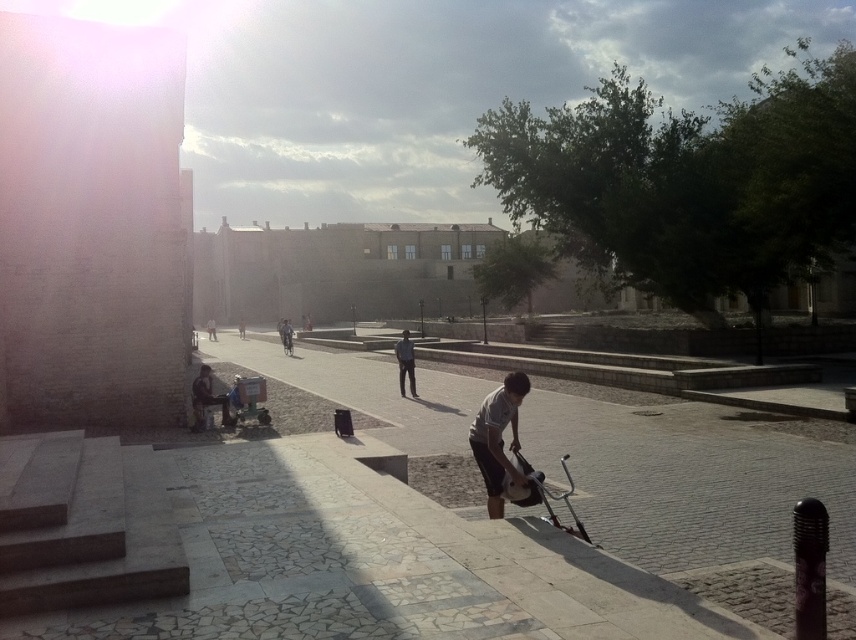
Does point (735, 460) come in front of point (413, 358)?

Yes, point (735, 460) is in front of point (413, 358).

Does gray stone pavement at center have a greater width compared to dark gray jeans at center?

Correct, the width of gray stone pavement at center exceeds that of dark gray jeans at center.

This screenshot has width=856, height=640. What do you see at coordinates (690, 481) in the screenshot?
I see `gray stone pavement at center` at bounding box center [690, 481].

Locate an element on the screen. This screenshot has width=856, height=640. gray stone pavement at center is located at coordinates (690, 481).

Is point (620, 490) less distant than point (519, 448)?

That is False.

At what (x,y) coordinates should I click in order to perform the action: click on gray stone pavement at center. Please return your answer as a coordinate pair (x, y). Looking at the image, I should click on (690, 481).

This screenshot has height=640, width=856. What do you see at coordinates (690, 481) in the screenshot? I see `gray stone pavement at center` at bounding box center [690, 481].

At what (x,y) coordinates should I click in order to perform the action: click on gray stone pavement at center. Please return your answer as a coordinate pair (x, y). Looking at the image, I should click on (690, 481).

Consider the image. Between gray matte skateboard at center and metallic silver baby carriage at lower right, which one is positioned higher?

gray matte skateboard at center is higher up.

Is gray matte skateboard at center positioned behind metallic silver baby carriage at lower right?

Yes, gray matte skateboard at center is further from the viewer.

At what (x,y) coordinates should I click in order to perform the action: click on gray matte skateboard at center. Please return your answer as a coordinate pair (x, y). The width and height of the screenshot is (856, 640). Looking at the image, I should click on (498, 440).

Image resolution: width=856 pixels, height=640 pixels. I want to click on gray matte skateboard at center, so click(x=498, y=440).